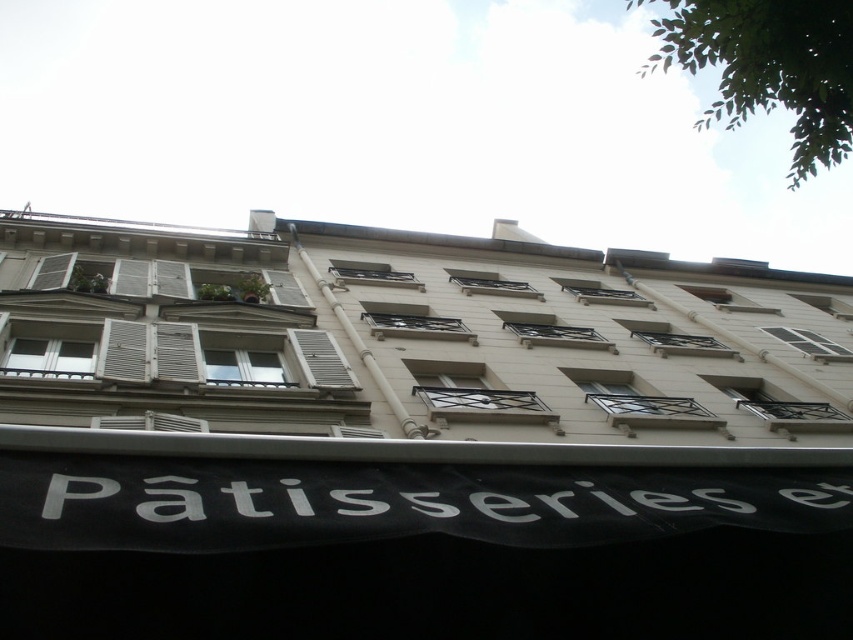
Question: Which of the following is the farthest from the observer?

Choices:
 (A) beige stone building at center
 (B) white matte shutter at center
 (C) white wooden shutter at center

Answer: (C)

Question: Which object is the closest to the white wooden shutter at center?

Choices:
 (A) white wooden shutters at left
 (B) beige stone building at center
 (C) white matte shutter at center

Answer: (A)

Question: Can you confirm if white wooden shutters at left is positioned to the right of white wooden shutter at center?

Choices:
 (A) yes
 (B) no

Answer: (B)

Question: Can you confirm if white wooden shutters at left is positioned above white matte shutter at center?

Choices:
 (A) no
 (B) yes

Answer: (B)

Question: Which of the following is the farthest from the observer?

Choices:
 (A) white wooden shutter at upper left
 (B) white wooden shutters at left
 (C) white matte shutter at center
 (D) white wooden shutter at center

Answer: (A)

Question: Does beige stone building at center appear on the right side of white wooden shutter at center?

Choices:
 (A) yes
 (B) no

Answer: (A)